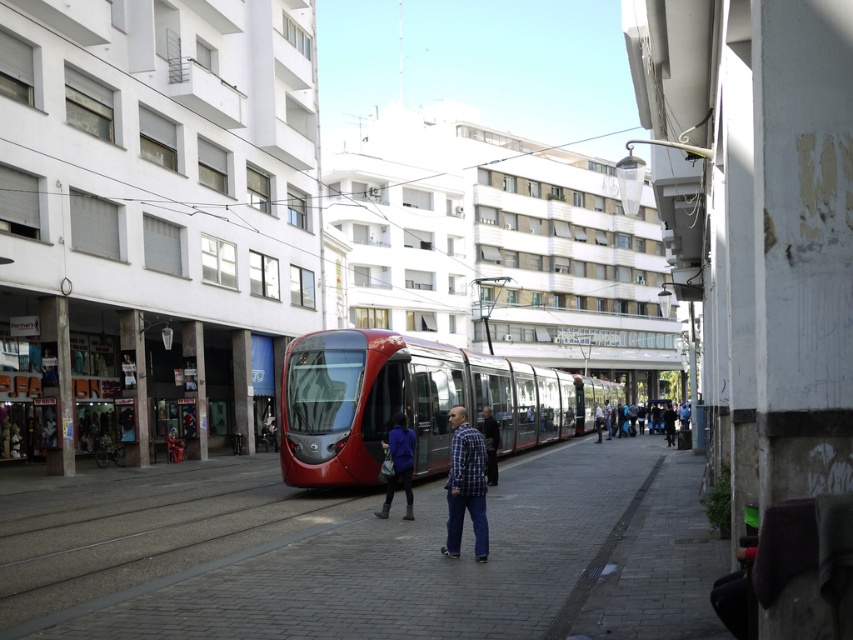
You are a pedestrian standing on the sidewalk and see the shiny red tram at center and the plaid shirt at center. Which object is wider?

The shiny red tram at center is wider than the plaid shirt at center.